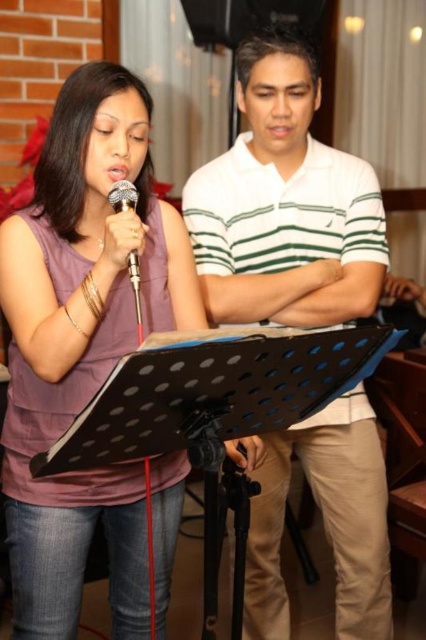
How distant is matte purple shirt at center from metallic silver microphone at center?

They are 12.66 inches apart.

Who is more forward, (126, 140) or (135, 205)?

Point (135, 205) is more forward.

Identify the location of matte purple shirt at center. This screenshot has width=426, height=640. (83, 346).

Who is more forward, (x=310, y=51) or (x=135, y=288)?

Point (x=135, y=288) is more forward.

Which is behind, point (305, 323) or point (120, 186)?

The point (305, 323) is more distant.

This screenshot has height=640, width=426. I want to click on white striped polo shirt at center, so click(x=284, y=204).

Consider the image. Does matte purple shirt at center have a lesser width compared to white striped polo shirt at center?

Yes.

Measure the distance between point (66,264) and camera.

A distance of 4.31 feet exists between point (66,264) and camera.

I want to click on matte purple shirt at center, so click(x=83, y=346).